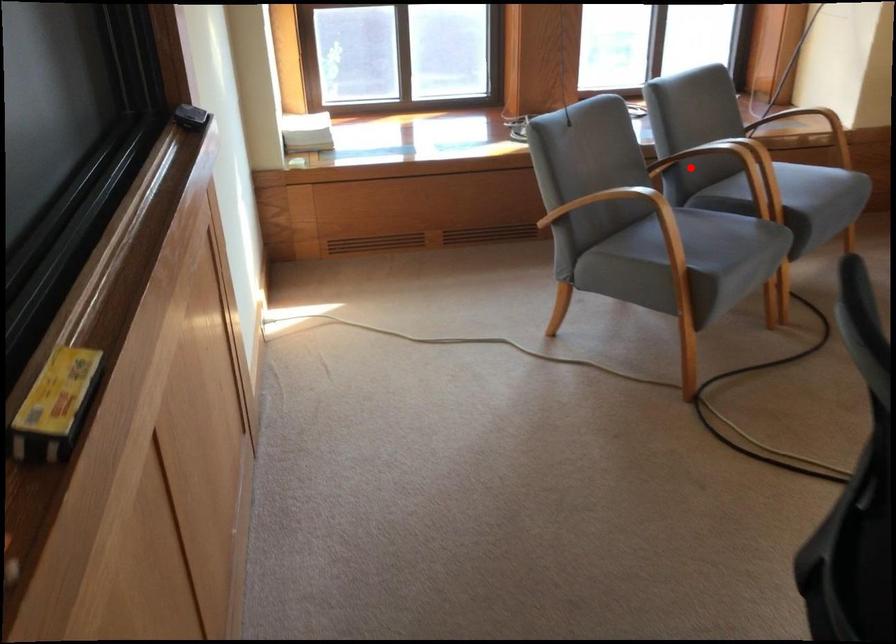
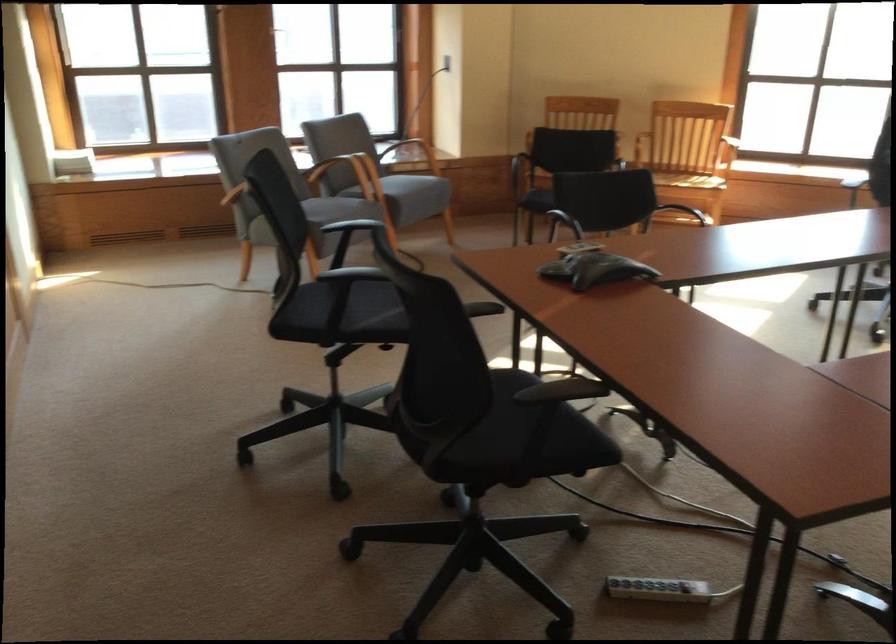
Question: A red point is marked in image1. In image2, is the corresponding 3D point closer to the camera or farther? Reply with the corresponding letter.

Choices:
 (A) The corresponding 3D point is closer.
 (B) The corresponding 3D point is farther.

Answer: (B)